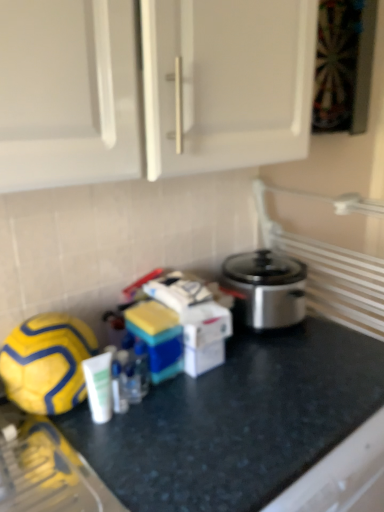
This screenshot has height=512, width=384. Identify the location of free location above black granite countertop at center (from a real-world perspective). (282, 371).